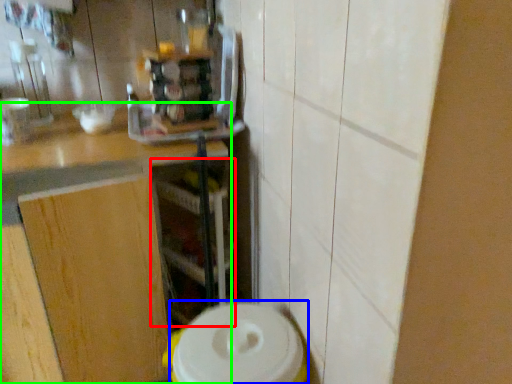
Question: Which is nearer to the shelf (highlighted by a red box)? appliance (highlighted by a blue box) or countertop (highlighted by a green box).

Choices:
 (A) appliance
 (B) countertop

Answer: (B)